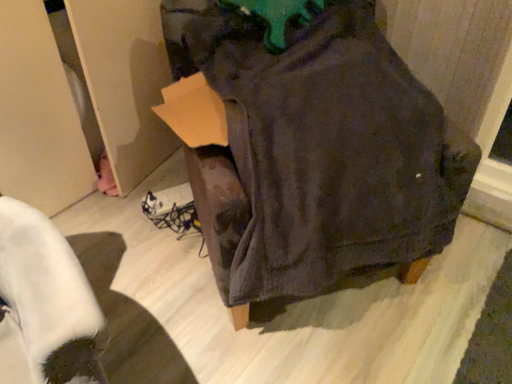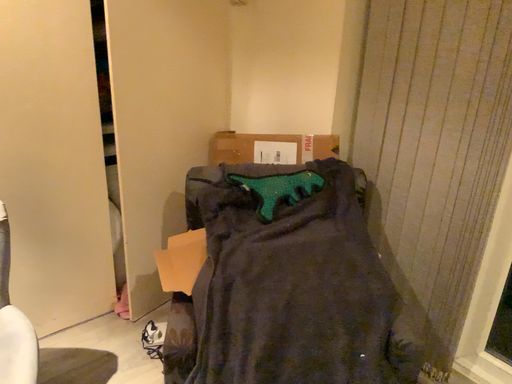
Question: Which way did the camera rotate in the video?

Choices:
 (A) rotated upward
 (B) rotated downward

Answer: (A)